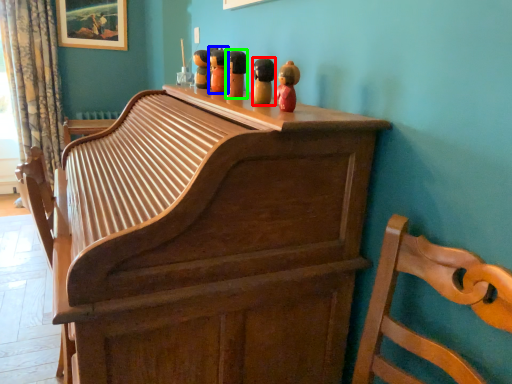
Question: Estimate the real-world distances between objects in this image. Which object is closer to toy (highlighted by a red box), toy (highlighted by a blue box) or toy (highlighted by a green box)?

Choices:
 (A) toy
 (B) toy

Answer: (B)